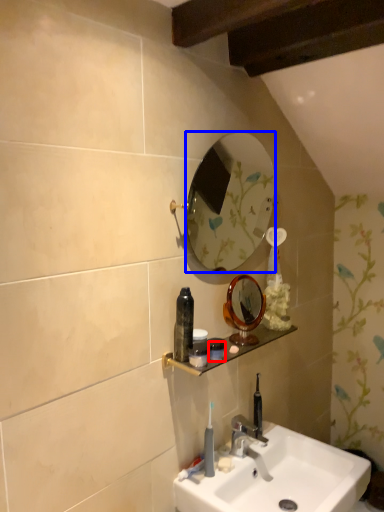
Question: Among these objects, which one is nearest to the camera, toiletry (highlighted by a red box) or mirror (highlighted by a blue box)?

Choices:
 (A) toiletry
 (B) mirror

Answer: (B)